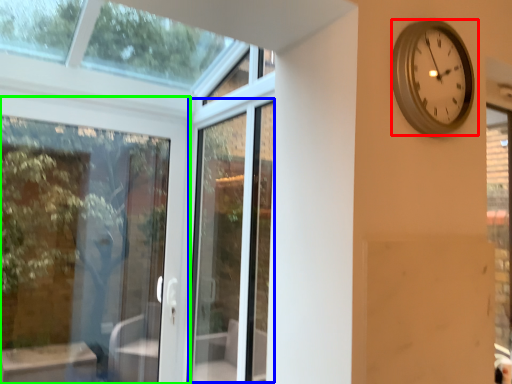
Question: Estimate the real-world distances between objects in this image. Which object is closer to wall clock (highlighted by a red box), screen door (highlighted by a blue box) or door (highlighted by a green box)?

Choices:
 (A) screen door
 (B) door

Answer: (A)